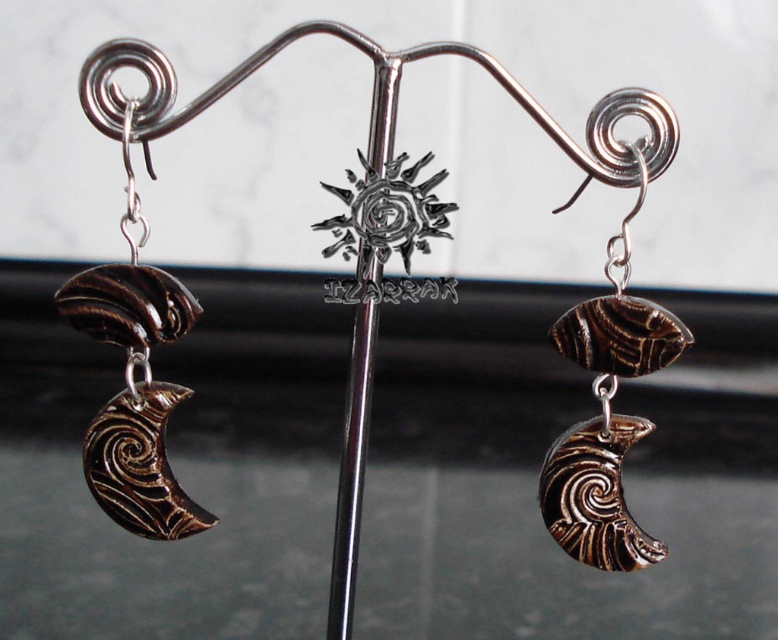
Question: Among these points, which one is farthest from the camera?

Choices:
 (A) (347, 490)
 (B) (608, 528)
 (C) (146, 518)

Answer: (C)

Question: Which object is the farthest from the polished silver rod at center?

Choices:
 (A) brown polished stone crescent moon at center
 (B) brown polished crescent moon at lower left

Answer: (B)

Question: Does brown polished stone crescent moon at center lie behind polished silver rod at center?

Choices:
 (A) no
 (B) yes

Answer: (B)

Question: Is brown polished crescent moon at lower left to the right of brown polished stone crescent moon at center from the viewer's perspective?

Choices:
 (A) no
 (B) yes

Answer: (A)

Question: Does brown polished crescent moon at lower left have a greater width compared to polished silver rod at center?

Choices:
 (A) yes
 (B) no

Answer: (B)

Question: Which point appears farthest from the camera in this image?

Choices:
 (A) (x=160, y=337)
 (B) (x=368, y=380)
 (C) (x=619, y=461)

Answer: (C)